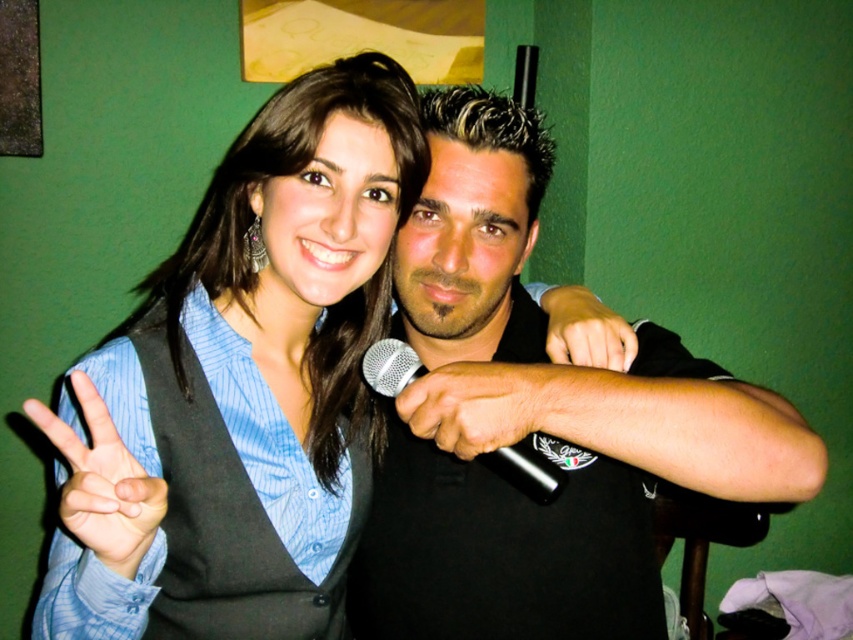
Can you confirm if blue striped shirt at center is taller than black matte microphone at center?

Indeed, blue striped shirt at center has a greater height compared to black matte microphone at center.

Is point (386, 104) in front of point (403, 406)?

No, it is behind (403, 406).

This screenshot has height=640, width=853. Identify the location of blue striped shirt at center. (242, 385).

Is point (598, 531) positioned behind point (126, 500)?

That is True.

Which is behind, point (469, 358) or point (94, 410)?

The point (469, 358) is behind.

At what (x,y) coordinates should I click in order to perform the action: click on black matte vest at center. Please return your answer as a coordinate pair (x, y). This screenshot has width=853, height=640. Looking at the image, I should click on (535, 422).

Does point (596, 360) lie in front of point (375, 364)?

No, (596, 360) is behind (375, 364).

Which is more to the left, matte black fist at center or silver metallic microphone at center?

From the viewer's perspective, silver metallic microphone at center appears more on the left side.

Is point (596, 337) closer to viewer compared to point (535, 492)?

No, (596, 337) is behind (535, 492).

Locate an element on the screen. This screenshot has width=853, height=640. matte black fist at center is located at coordinates (585, 330).